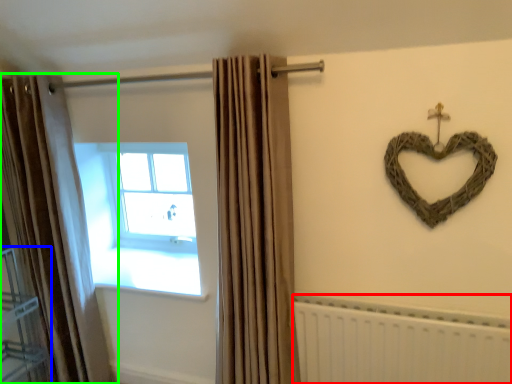
Question: Estimate the real-world distances between objects in this image. Which object is closer to radiator (highlighted by a red box), shelf (highlighted by a blue box) or curtain (highlighted by a green box)?

Choices:
 (A) shelf
 (B) curtain

Answer: (B)